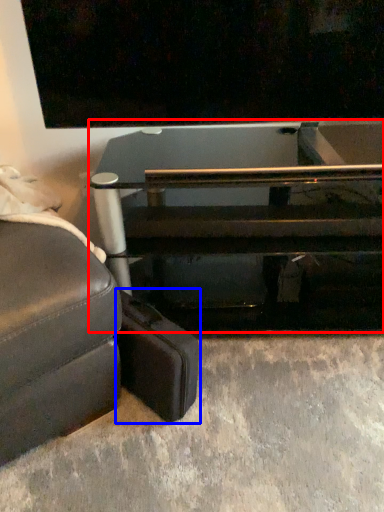
Question: Which object appears farthest to the camera in this image, table (highlighted by a red box) or luggage (highlighted by a blue box)?

Choices:
 (A) table
 (B) luggage

Answer: (A)